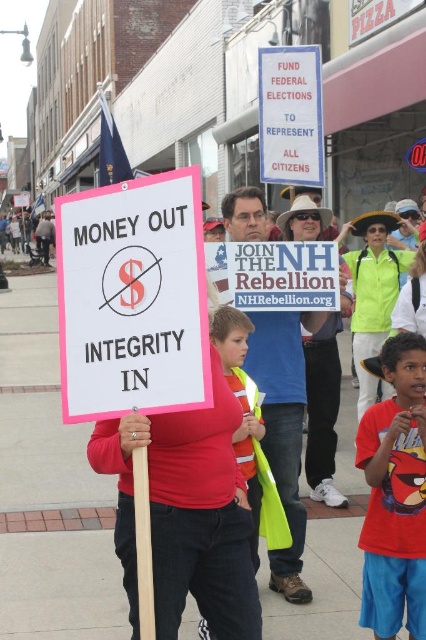
You are a photographer trying to capture both the pink plastic sign at center and the blue denim jeans at center in a single frame. Based on their sizes in the image, which object would you need to position closer to the camera to ensure both are clearly visible?

The pink plastic sign at center occupies less space than the blue denim jeans at center. To ensure both are clearly visible, you should position the pink plastic sign at center closer to the camera since it is smaller and needs to be enlarged in the frame to match the visibility of the blue denim jeans at center.

You are a photographer standing at the edge of the protest to capture both the pink plastic sign at center and the white paper sign at center in one frame. What is the minimum distance you need to move back to ensure both signs are fully visible?

The pink plastic sign at center and white paper sign at center are 8.41 feet apart from each other. To capture both in one frame, you need to move back at least 8.41 feet from the closest sign.

You are a delivery drone with a 1.5 meter wingspan. You need to fly from the blue denim jeans at center to the white paper sign at upper center. Can you safely navigate the space between them without colliding?

The distance between blue denim jeans at center and white paper sign at upper center is 1.92 meters. Since your wingspan is 1.5 meters, you have enough space to safely navigate the path between them as the distance is greater than your wingspan.